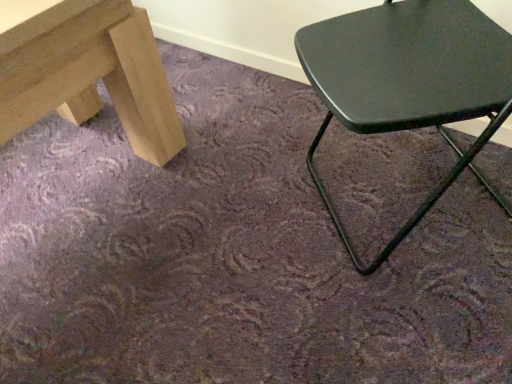
Locate an element on the screen. vacant area that is in front of metallic green chair at right is located at coordinates (412, 318).